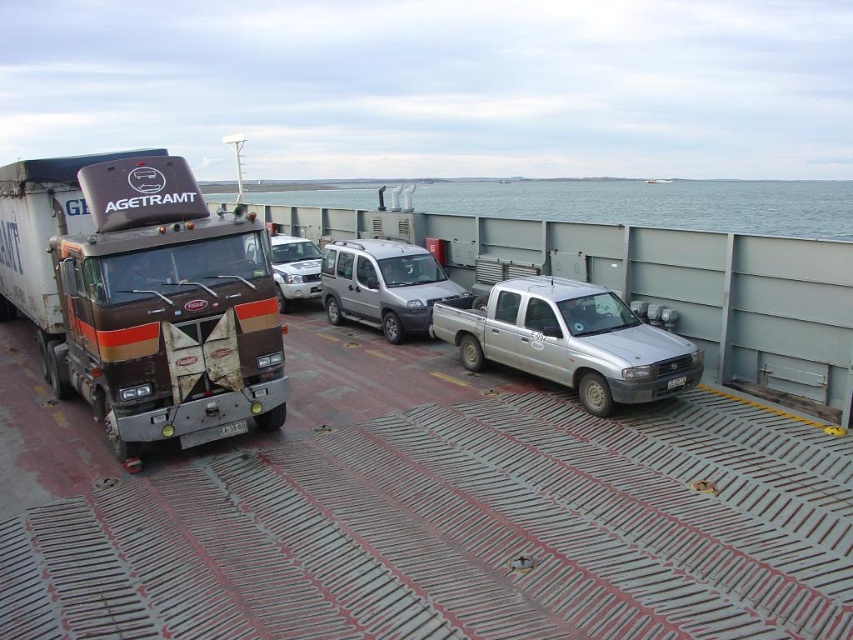
Question: Is silver metallic pickup truck at center thinner than black plastic license plate at lower right?

Choices:
 (A) yes
 (B) no

Answer: (B)

Question: Estimate the real-world distances between objects in this image. Which object is farther from the gray water at upper center?

Choices:
 (A) black plastic license plate at lower right
 (B) silver metallic van at center
 (C) silver metallic pickup truck at center
 (D) brown matte truck at left

Answer: (A)

Question: Among these objects, which one is nearest to the camera?

Choices:
 (A) brown matte truck at left
 (B) gray water at upper center

Answer: (A)

Question: Is silver metallic pickup truck at center bigger than silver metallic van at center?

Choices:
 (A) yes
 (B) no

Answer: (A)

Question: Which point appears closest to the camera in this image?

Choices:
 (A) (421, 253)
 (B) (686, 378)
 (C) (276, 241)
 (D) (202, 221)

Answer: (D)

Question: Can you confirm if silver metallic pickup truck at center is positioned to the right of black plastic license plate at lower right?

Choices:
 (A) yes
 (B) no

Answer: (B)